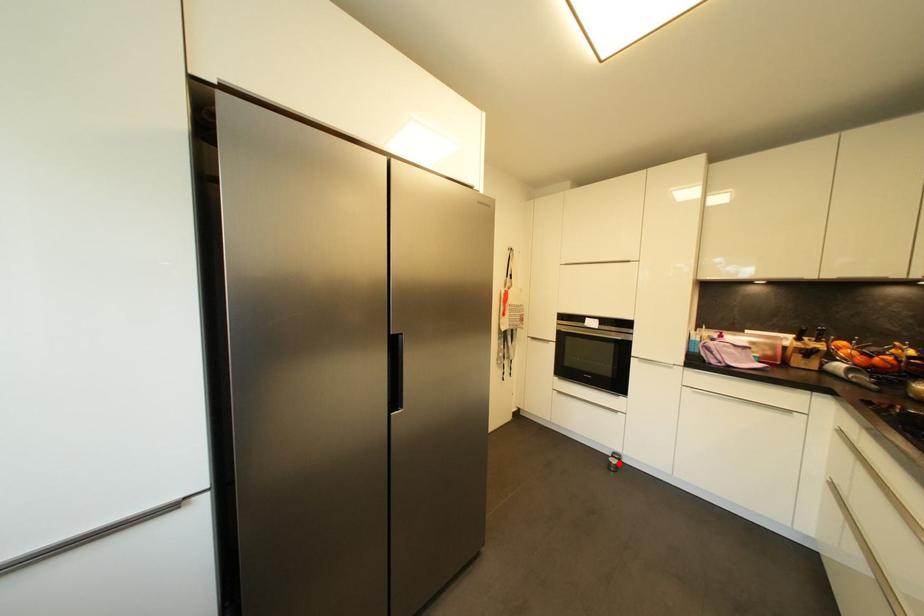
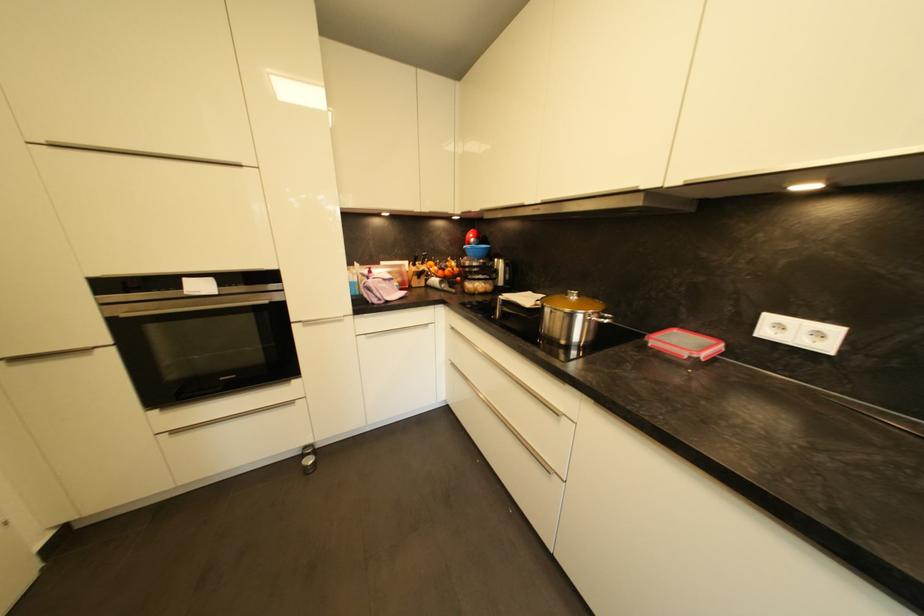
Locate, in the second image, the point that corresponds to the highlighted location in the first image.

(313, 463)